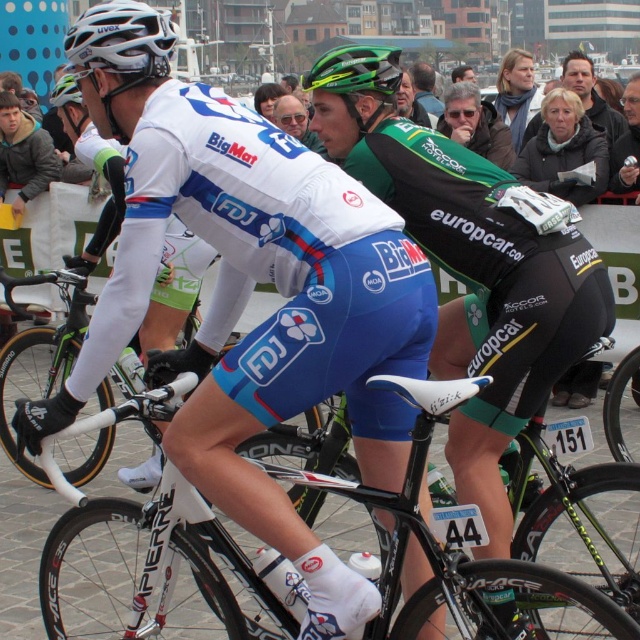
Question: Is the position of green matte bicycle helmet at center more distant than that of green matte helmet at upper center?

Choices:
 (A) no
 (B) yes

Answer: (A)

Question: Which of these objects is positioned closest to the green matte bicycle helmet at center?

Choices:
 (A) white matte bicycle at center
 (B) black/green jersey at center
 (C) white matte bicycle helmet at upper left
 (D) green matte helmet at upper center

Answer: (B)

Question: Estimate the real-world distances between objects in this image. Which object is closer to the white matte bicycle helmet at upper left?

Choices:
 (A) matte white bicycle at center
 (B) green matte helmet at upper center
 (C) white matte bicycle at center
 (D) black jersey at center

Answer: (A)

Question: Which point appears closest to the camera in this image?

Choices:
 (A) (349, 113)
 (B) (170, 563)
 (C) (163, 52)

Answer: (B)

Question: Does white matte bicycle at center appear under black jersey at center?

Choices:
 (A) no
 (B) yes

Answer: (B)

Question: Can you confirm if matte white bicycle at center is positioned to the left of green matte helmet at upper center?

Choices:
 (A) yes
 (B) no

Answer: (B)